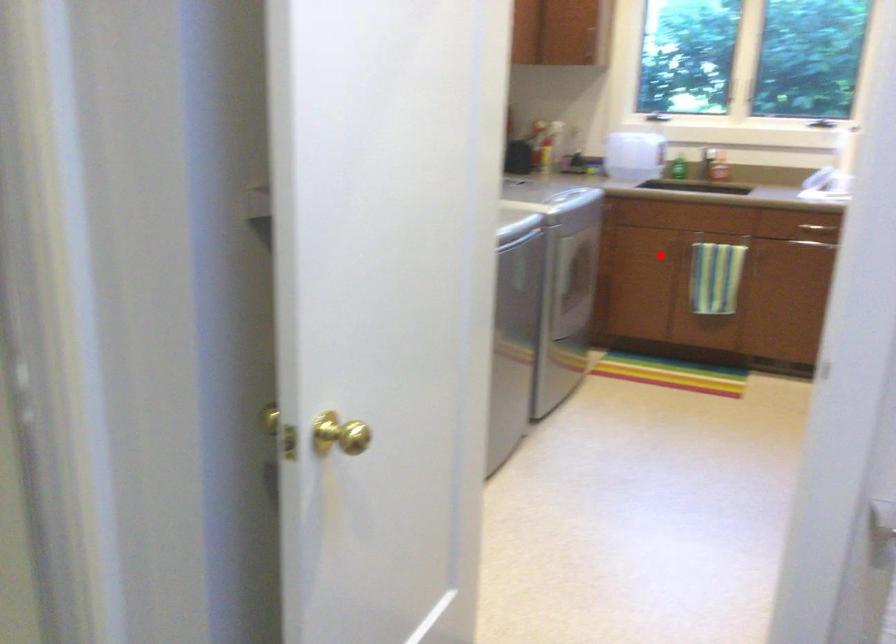
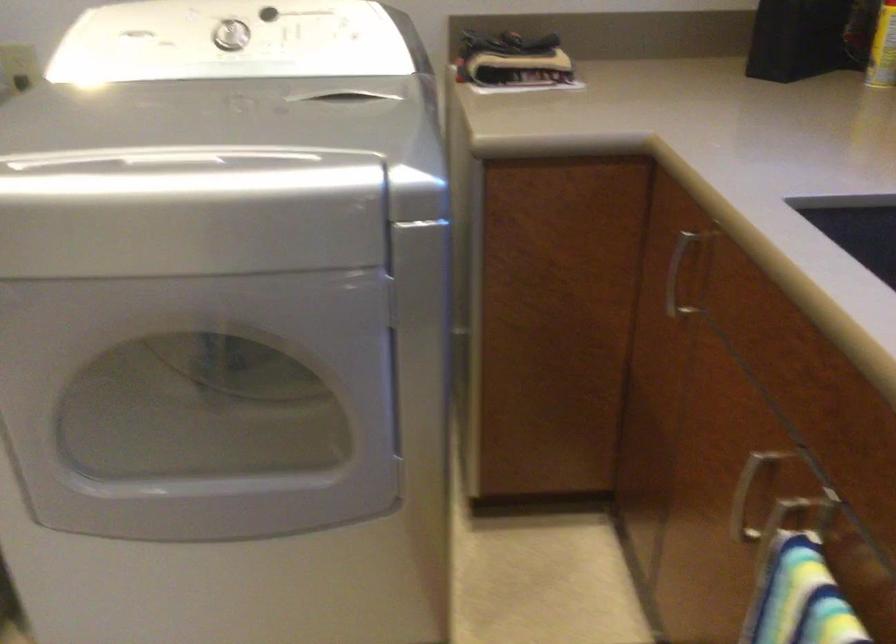
In the second image, find the point that corresponds to the highlighted location in the first image.

(745, 497)